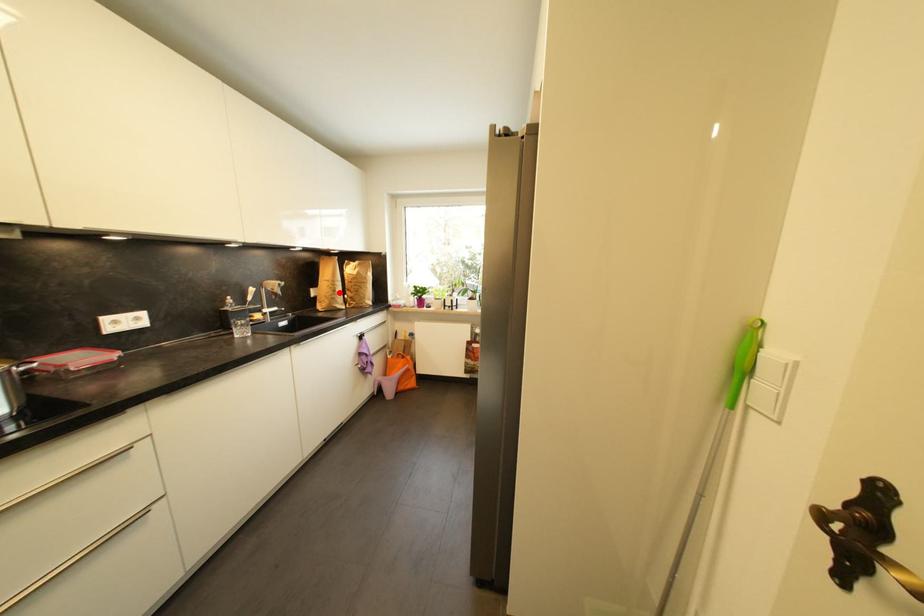
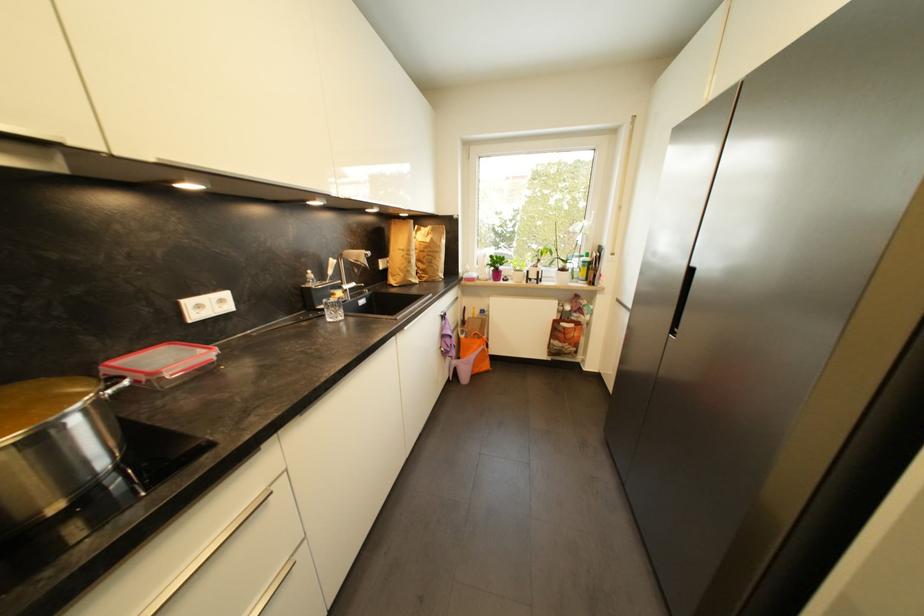
The point at the highlighted location is marked in the first image. Where is the corresponding point in the second image?

(415, 264)